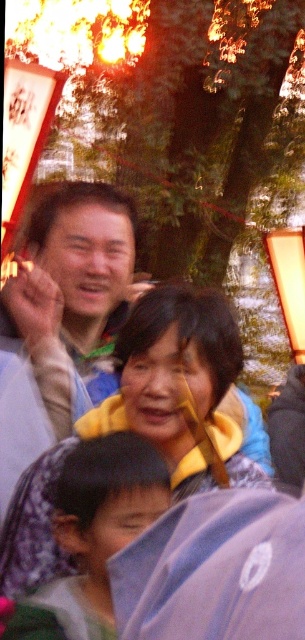
Between matte gray shirt at center and blue fabric umbrella at lower center, which one has more height?

matte gray shirt at center

Can you confirm if matte gray shirt at center is positioned above blue fabric umbrella at lower center?

Yes.

Image resolution: width=305 pixels, height=640 pixels. What do you see at coordinates (58, 316) in the screenshot? I see `matte gray shirt at center` at bounding box center [58, 316].

The width and height of the screenshot is (305, 640). Find the location of `matte gray shirt at center`. matte gray shirt at center is located at coordinates click(58, 316).